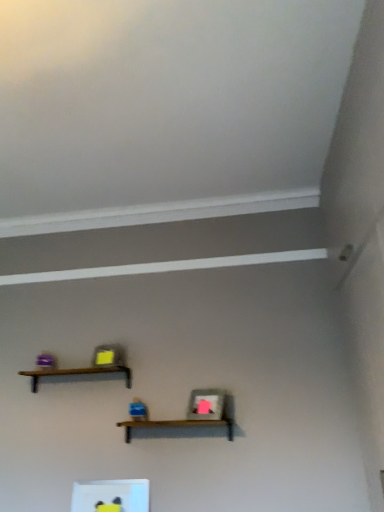
Identify the location of brown wooden shelf at upper center, which is the 1th shelf in top-to-bottom order. (77, 373).

What do you see at coordinates (111, 495) in the screenshot? I see `white glossy frame at lower center, which ranks as the third shelf in top-to-bottom order` at bounding box center [111, 495].

From the picture: Measure the distance between point (72, 504) and camera.

Point (72, 504) and camera are 8.05 feet apart.

I want to click on brown wooden shelf at center, which appears as the 2th shelf when viewed from the top, so click(177, 425).

From the image's perspective, relative to brown wooden shelf at center, the 2th shelf in the bottom-to-top sequence, is white glossy frame at lower center, which is the 1th shelf from bottom to top, above or below?

Based on their image positions, white glossy frame at lower center, which is the 1th shelf from bottom to top, is located beneath brown wooden shelf at center, the 2th shelf in the bottom-to-top sequence.

Is there a large distance between white glossy frame at lower center, which ranks as the third shelf in top-to-bottom order, and brown wooden shelf at center, the 2th shelf in the bottom-to-top sequence?

Actually, white glossy frame at lower center, which ranks as the third shelf in top-to-bottom order, and brown wooden shelf at center, the 2th shelf in the bottom-to-top sequence, are a little close together.

From a real-world perspective, is white glossy frame at lower center, which is the 1th shelf from bottom to top, above or below brown wooden shelf at center, the 2th shelf in the bottom-to-top sequence?

Clearly, from a real-world perspective, white glossy frame at lower center, which is the 1th shelf from bottom to top, is below brown wooden shelf at center, the 2th shelf in the bottom-to-top sequence.

From the image's perspective, starting from the brown wooden shelf at upper center, which is the 1th shelf in top-to-bottom order, which shelf is the 1st one below? Please provide its 2D coordinates.

[(177, 425)]

Considering the relative positions of brown wooden shelf at upper center, which is the 1th shelf in top-to-bottom order, and brown wooden shelf at center, the 2th shelf in the bottom-to-top sequence, in the image provided, is brown wooden shelf at upper center, which is the 1th shelf in top-to-bottom order, to the left of brown wooden shelf at center, the 2th shelf in the bottom-to-top sequence, from the viewer's perspective?

Correct, you'll find brown wooden shelf at upper center, which is the 1th shelf in top-to-bottom order, to the left of brown wooden shelf at center, the 2th shelf in the bottom-to-top sequence.

Is brown wooden shelf at upper center, which is the 1th shelf in top-to-bottom order, positioned in front of brown wooden shelf at center, the 2th shelf in the bottom-to-top sequence?

That is False.

Considering the sizes of objects brown wooden shelf at upper center, which is the 1th shelf in top-to-bottom order, and brown wooden shelf at center, which appears as the 2th shelf when viewed from the top, in the image provided, who is thinner, brown wooden shelf at upper center, which is the 1th shelf in top-to-bottom order, or brown wooden shelf at center, which appears as the 2th shelf when viewed from the top,?

Thinner between the two is brown wooden shelf at upper center, which is the 1th shelf in top-to-bottom order.

Is point (125, 480) closer or farther from the camera than point (118, 366)?

Point (125, 480) appears to be closer to the viewer than point (118, 366).

Is white glossy frame at lower center, which ranks as the third shelf in top-to-bottom order, taller or shorter than brown wooden shelf at upper center, the third shelf in the bottom-to-top sequence?

In the image, white glossy frame at lower center, which ranks as the third shelf in top-to-bottom order, appears to be taller than brown wooden shelf at upper center, the third shelf in the bottom-to-top sequence.

Is white glossy frame at lower center, which is the 1th shelf from bottom to top, not near brown wooden shelf at upper center, which is the 1th shelf in top-to-bottom order?

Actually, white glossy frame at lower center, which is the 1th shelf from bottom to top, and brown wooden shelf at upper center, which is the 1th shelf in top-to-bottom order, are a little close together.

Do you think white glossy frame at lower center, which is the 1th shelf from bottom to top, is within brown wooden shelf at upper center, the third shelf in the bottom-to-top sequence, or outside of it?

white glossy frame at lower center, which is the 1th shelf from bottom to top, is spatially situated outside brown wooden shelf at upper center, the third shelf in the bottom-to-top sequence.

Which object is positioned more to the left, brown wooden shelf at center, which appears as the 2th shelf when viewed from the top, or white glossy frame at lower center, which ranks as the third shelf in top-to-bottom order?

From the viewer's perspective, white glossy frame at lower center, which ranks as the third shelf in top-to-bottom order, appears more on the left side.

Between brown wooden shelf at center, the 2th shelf in the bottom-to-top sequence, and white glossy frame at lower center, which is the 1th shelf from bottom to top, which one has larger size?

brown wooden shelf at center, the 2th shelf in the bottom-to-top sequence, is bigger.

You are a GUI agent. You are given a task and a screenshot of the screen. Output one action in this format:
    pyautogui.click(x=<x>, y=<y>)
    Task: Click on the shelf below the brown wooden shelf at center, which appears as the 2th shelf when viewed from the top (from the image's perspective)
    Image resolution: width=384 pixels, height=512 pixels.
    Given the screenshot: What is the action you would take?
    pyautogui.click(x=111, y=495)

Can you confirm if brown wooden shelf at center, which appears as the 2th shelf when viewed from the top, is bigger than brown wooden shelf at upper center, the third shelf in the bottom-to-top sequence?

Indeed, brown wooden shelf at center, which appears as the 2th shelf when viewed from the top, has a larger size compared to brown wooden shelf at upper center, the third shelf in the bottom-to-top sequence.

In the scene shown: Which of these two, brown wooden shelf at center, which appears as the 2th shelf when viewed from the top, or brown wooden shelf at upper center, which is the 1th shelf in top-to-bottom order, stands taller?

With more height is brown wooden shelf at center, which appears as the 2th shelf when viewed from the top.

Would you say brown wooden shelf at center, the 2th shelf in the bottom-to-top sequence, is a long distance from brown wooden shelf at upper center, the third shelf in the bottom-to-top sequence?

That's not correct — brown wooden shelf at center, the 2th shelf in the bottom-to-top sequence, is a little close to brown wooden shelf at upper center, the third shelf in the bottom-to-top sequence.

This screenshot has height=512, width=384. In order to click on shelf above the brown wooden shelf at center, which appears as the 2th shelf when viewed from the top (from a real-world perspective) in this screenshot , I will do `click(77, 373)`.

Between point (32, 378) and point (116, 490), which one is positioned in front?

The point (116, 490) is closer to the camera.

Would you say brown wooden shelf at upper center, the third shelf in the bottom-to-top sequence, is inside or outside white glossy frame at lower center, which ranks as the third shelf in top-to-bottom order?

brown wooden shelf at upper center, the third shelf in the bottom-to-top sequence, cannot be found inside white glossy frame at lower center, which ranks as the third shelf in top-to-bottom order.

Looking at this image, is brown wooden shelf at upper center, the third shelf in the bottom-to-top sequence, thinner than white glossy frame at lower center, which is the 1th shelf from bottom to top?

In fact, brown wooden shelf at upper center, the third shelf in the bottom-to-top sequence, might be wider than white glossy frame at lower center, which is the 1th shelf from bottom to top.

Does brown wooden shelf at upper center, the third shelf in the bottom-to-top sequence, lie in front of white glossy frame at lower center, which is the 1th shelf from bottom to top?

No, brown wooden shelf at upper center, the third shelf in the bottom-to-top sequence, is further to the viewer.

Find the location of a particular element. The width and height of the screenshot is (384, 512). the 1st shelf above the white glossy frame at lower center, which is the 1th shelf from bottom to top (from a real-world perspective) is located at coordinates (177, 425).

At what (x,y) coordinates should I click in order to perform the action: click on the 2nd shelf to the left of the brown wooden shelf at center, the 2th shelf in the bottom-to-top sequence, counting from the anchor's position. Please return your answer as a coordinate pair (x, y). Image resolution: width=384 pixels, height=512 pixels. Looking at the image, I should click on (77, 373).

Looking at this image, looking at the image, which one is located closer to brown wooden shelf at center, the 2th shelf in the bottom-to-top sequence, white glossy frame at lower center, which is the 1th shelf from bottom to top, or brown wooden shelf at upper center, the third shelf in the bottom-to-top sequence?

Based on the image, white glossy frame at lower center, which is the 1th shelf from bottom to top, appears to be nearer to brown wooden shelf at center, the 2th shelf in the bottom-to-top sequence.

Which object lies further to the anchor point brown wooden shelf at upper center, which is the 1th shelf in top-to-bottom order, brown wooden shelf at center, which appears as the 2th shelf when viewed from the top, or white glossy frame at lower center, which ranks as the third shelf in top-to-bottom order?

white glossy frame at lower center, which ranks as the third shelf in top-to-bottom order.

When comparing their distances from white glossy frame at lower center, which ranks as the third shelf in top-to-bottom order, does brown wooden shelf at upper center, which is the 1th shelf in top-to-bottom order, or brown wooden shelf at center, the 2th shelf in the bottom-to-top sequence, seem further?

brown wooden shelf at upper center, which is the 1th shelf in top-to-bottom order, is further to white glossy frame at lower center, which ranks as the third shelf in top-to-bottom order.

Consider the image. When comparing their distances from brown wooden shelf at center, which appears as the 2th shelf when viewed from the top, does brown wooden shelf at upper center, the third shelf in the bottom-to-top sequence, or white glossy frame at lower center, which ranks as the third shelf in top-to-bottom order, seem closer?

Among the two, white glossy frame at lower center, which ranks as the third shelf in top-to-bottom order, is located nearer to brown wooden shelf at center, which appears as the 2th shelf when viewed from the top.

From the image, which object appears to be farther from white glossy frame at lower center, which is the 1th shelf from bottom to top, brown wooden shelf at center, which appears as the 2th shelf when viewed from the top, or brown wooden shelf at upper center, which is the 1th shelf in top-to-bottom order?

The object further to white glossy frame at lower center, which is the 1th shelf from bottom to top, is brown wooden shelf at upper center, which is the 1th shelf in top-to-bottom order.

Which object lies nearer to the anchor point brown wooden shelf at upper center, which is the 1th shelf in top-to-bottom order, white glossy frame at lower center, which is the 1th shelf from bottom to top, or brown wooden shelf at center, which appears as the 2th shelf when viewed from the top?

brown wooden shelf at center, which appears as the 2th shelf when viewed from the top, lies closer to brown wooden shelf at upper center, which is the 1th shelf in top-to-bottom order, than the other object.

Where is `shelf situated between brown wooden shelf at upper center, which is the 1th shelf in top-to-bottom order, and brown wooden shelf at center, the 2th shelf in the bottom-to-top sequence, from left to right`? The image size is (384, 512). shelf situated between brown wooden shelf at upper center, which is the 1th shelf in top-to-bottom order, and brown wooden shelf at center, the 2th shelf in the bottom-to-top sequence, from left to right is located at coordinates (111, 495).